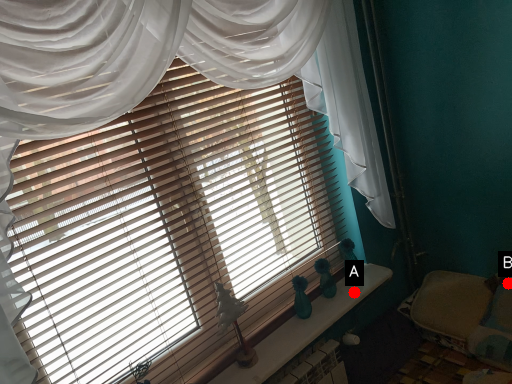
Question: Two points are circled on the image, labeled by A and B beside each circle. Which point is further to the camera?

Choices:
 (A) A is further
 (B) B is further

Answer: (A)